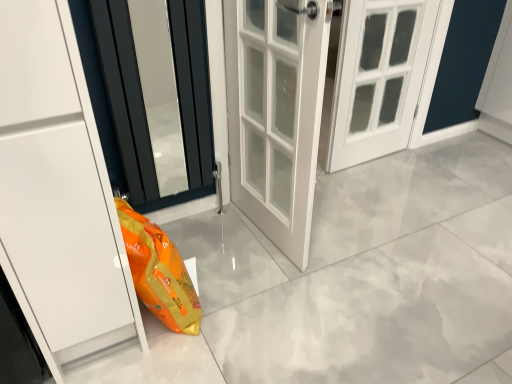
The image size is (512, 384). What do you see at coordinates (159, 272) in the screenshot?
I see `orange plastic grocery bag at lower left` at bounding box center [159, 272].

Locate an element on the screen. The height and width of the screenshot is (384, 512). orange plastic grocery bag at lower left is located at coordinates (159, 272).

The image size is (512, 384). What are the coordinates of `orange plastic grocery bag at lower left` in the screenshot? It's located at (159, 272).